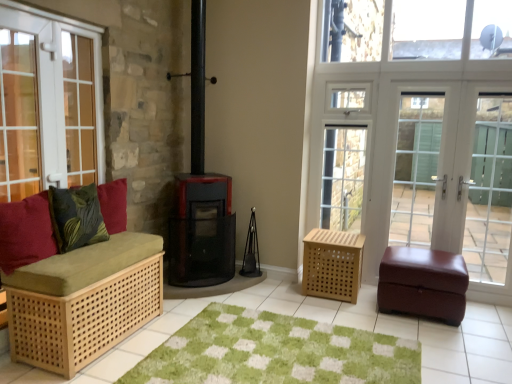
At what (x,y) coordinates should I click in order to perform the action: click on free spot above white glass door at left (from a real-world perspective). Please return your answer as a coordinate pair (x, y). Looking at the image, I should click on (80, 20).